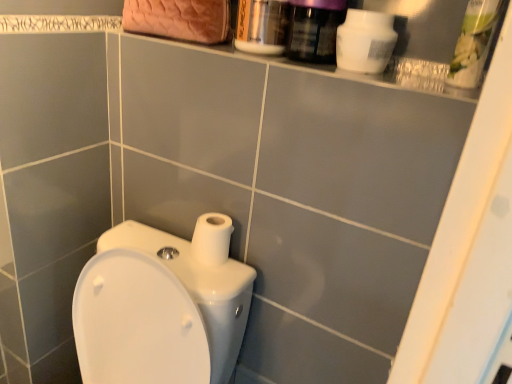
You are a GUI agent. You are given a task and a screenshot of the screen. Output one action in this format:
    pyautogui.click(x=<x>, y=<y>)
    Task: Click on the green plastic container at upper right, arranged as the 2th cleaning product when viewed from the left
    This screenshot has height=384, width=512.
    Given the screenshot: What is the action you would take?
    pyautogui.click(x=474, y=43)

What is the approximate width of purple glossy mouthwash at upper right, placed as the second mouthwash when sorted from left to right?

The width of purple glossy mouthwash at upper right, placed as the second mouthwash when sorted from left to right, is 3.79 inches.

The width and height of the screenshot is (512, 384). Describe the element at coordinates (365, 41) in the screenshot. I see `white matte bottle at upper right, marked as the 1th cleaning product in a left-to-right arrangement` at that location.

This screenshot has height=384, width=512. In order to click on white matte toilet paper at center in this screenshot , I will do `click(212, 239)`.

The image size is (512, 384). I want to click on white glossy toilet at lower left, so click(x=161, y=306).

Identify the location of mouthwash on the left of purple glossy mouthwash at upper right, placed as the second mouthwash when sorted from left to right. The image size is (512, 384). (262, 26).

How different are the orientations of purple glossy mouthwash at upper right, marked as the first mouthwash in a right-to-left arrangement, and metallic silver mouthwash at upper center, marked as the 2th mouthwash in a right-to-left arrangement, in degrees?

The facing directions of purple glossy mouthwash at upper right, marked as the first mouthwash in a right-to-left arrangement, and metallic silver mouthwash at upper center, marked as the 2th mouthwash in a right-to-left arrangement, are 2.15 degrees apart.

From a real-world perspective, who is located lower, purple glossy mouthwash at upper right, placed as the second mouthwash when sorted from left to right, or metallic silver mouthwash at upper center, marked as the 2th mouthwash in a right-to-left arrangement?

In real-world perspective, metallic silver mouthwash at upper center, marked as the 2th mouthwash in a right-to-left arrangement, is lower.

Is metallic silver mouthwash at upper center, marked as the 2th mouthwash in a right-to-left arrangement, to the left or to the right of green plastic container at upper right, marked as the first cleaning product in a right-to-left arrangement, in the image?

In the image, metallic silver mouthwash at upper center, marked as the 2th mouthwash in a right-to-left arrangement, appears on the left side of green plastic container at upper right, marked as the first cleaning product in a right-to-left arrangement.

Image resolution: width=512 pixels, height=384 pixels. I want to click on mouthwash that is the 2nd one when counting backward from the green plastic container at upper right, arranged as the 2th cleaning product when viewed from the left, so click(x=262, y=26).

Looking at this image, considering the sizes of objects metallic silver mouthwash at upper center, positioned as the first mouthwash in left-to-right order, and green plastic container at upper right, marked as the first cleaning product in a right-to-left arrangement, in the image provided, who is taller, metallic silver mouthwash at upper center, positioned as the first mouthwash in left-to-right order, or green plastic container at upper right, marked as the first cleaning product in a right-to-left arrangement,?

With more height is green plastic container at upper right, marked as the first cleaning product in a right-to-left arrangement.

Is metallic silver mouthwash at upper center, positioned as the first mouthwash in left-to-right order, looking in the opposite direction of green plastic container at upper right, arranged as the 2th cleaning product when viewed from the left?

metallic silver mouthwash at upper center, positioned as the first mouthwash in left-to-right order, is not turned away from green plastic container at upper right, arranged as the 2th cleaning product when viewed from the left.

Is green plastic container at upper right, arranged as the 2th cleaning product when viewed from the left, next to purple glossy mouthwash at upper right, placed as the second mouthwash when sorted from left to right?

They are not placed beside each other.

Considering the sizes of objects green plastic container at upper right, arranged as the 2th cleaning product when viewed from the left, and purple glossy mouthwash at upper right, placed as the second mouthwash when sorted from left to right, in the image provided, who is thinner, green plastic container at upper right, arranged as the 2th cleaning product when viewed from the left, or purple glossy mouthwash at upper right, placed as the second mouthwash when sorted from left to right,?

green plastic container at upper right, arranged as the 2th cleaning product when viewed from the left.

From a real-world perspective, relative to purple glossy mouthwash at upper right, placed as the second mouthwash when sorted from left to right, is green plastic container at upper right, arranged as the 2th cleaning product when viewed from the left, vertically above or below?

In terms of real-world spatial position, green plastic container at upper right, arranged as the 2th cleaning product when viewed from the left, is above purple glossy mouthwash at upper right, placed as the second mouthwash when sorted from left to right.

Between point (481, 10) and point (323, 14), which one is positioned behind?

The point (323, 14) is farther from the camera.

The height and width of the screenshot is (384, 512). I want to click on mouthwash that is the 2nd object to the left of the white matte bottle at upper right, which is the second cleaning product in right-to-left order, starting at the anchor, so click(x=262, y=26).

Based on their positions, is white matte bottle at upper right, marked as the 1th cleaning product in a left-to-right arrangement, located to the left or right of metallic silver mouthwash at upper center, positioned as the first mouthwash in left-to-right order?

white matte bottle at upper right, marked as the 1th cleaning product in a left-to-right arrangement, is to the right of metallic silver mouthwash at upper center, positioned as the first mouthwash in left-to-right order.

Is white matte bottle at upper right, which is the second cleaning product in right-to-left order, positioned before metallic silver mouthwash at upper center, marked as the 2th mouthwash in a right-to-left arrangement?

That is True.

Based on their sizes in the image, would you say white matte toilet paper at center is bigger or smaller than green plastic container at upper right, arranged as the 2th cleaning product when viewed from the left?

Considering their sizes, white matte toilet paper at center takes up less space than green plastic container at upper right, arranged as the 2th cleaning product when viewed from the left.

From a real-world perspective, which object stands above the other?

From a 3D spatial view, green plastic container at upper right, marked as the first cleaning product in a right-to-left arrangement, is above.

Is point (198, 233) positioned in front of point (474, 86)?

No, it is behind (474, 86).

Can you confirm if white matte toilet paper at center is shorter than green plastic container at upper right, marked as the first cleaning product in a right-to-left arrangement?

Correct, white matte toilet paper at center is not as tall as green plastic container at upper right, marked as the first cleaning product in a right-to-left arrangement.

Is white matte bottle at upper right, marked as the 1th cleaning product in a left-to-right arrangement, directly adjacent to purple glossy mouthwash at upper right, marked as the first mouthwash in a right-to-left arrangement?

Yes, white matte bottle at upper right, marked as the 1th cleaning product in a left-to-right arrangement, is next to purple glossy mouthwash at upper right, marked as the first mouthwash in a right-to-left arrangement.

Is white matte bottle at upper right, marked as the 1th cleaning product in a left-to-right arrangement, not inside purple glossy mouthwash at upper right, marked as the first mouthwash in a right-to-left arrangement?

Yes, white matte bottle at upper right, marked as the 1th cleaning product in a left-to-right arrangement, is outside of purple glossy mouthwash at upper right, marked as the first mouthwash in a right-to-left arrangement.

At what (x,y) coordinates should I click in order to perform the action: click on the 1st mouthwash behind the white matte bottle at upper right, which is the second cleaning product in right-to-left order, starting your count from the anchor. Please return your answer as a coordinate pair (x, y). Looking at the image, I should click on (314, 30).

From the picture: From a real-world perspective, which object stands above the other?

Result: purple glossy mouthwash at upper right, placed as the second mouthwash when sorted from left to right, from a real-world perspective.

Does point (255, 6) come behind point (337, 6)?

Yes, it is behind point (337, 6).

Identify the location of mouthwash that is on the left side of purple glossy mouthwash at upper right, marked as the first mouthwash in a right-to-left arrangement. (262, 26).

Does metallic silver mouthwash at upper center, marked as the 2th mouthwash in a right-to-left arrangement, turn towards purple glossy mouthwash at upper right, marked as the first mouthwash in a right-to-left arrangement?

No, metallic silver mouthwash at upper center, marked as the 2th mouthwash in a right-to-left arrangement, is not turned towards purple glossy mouthwash at upper right, marked as the first mouthwash in a right-to-left arrangement.

Is metallic silver mouthwash at upper center, positioned as the first mouthwash in left-to-right order, completely or partially outside of purple glossy mouthwash at upper right, placed as the second mouthwash when sorted from left to right?

metallic silver mouthwash at upper center, positioned as the first mouthwash in left-to-right order, lies outside purple glossy mouthwash at upper right, placed as the second mouthwash when sorted from left to right,'s area.

At what (x,y) coordinates should I click in order to perform the action: click on mouthwash that is in front of the metallic silver mouthwash at upper center, marked as the 2th mouthwash in a right-to-left arrangement. Please return your answer as a coordinate pair (x, y). Looking at the image, I should click on (314, 30).

Locate an element on the screen. The image size is (512, 384). the 2nd cleaning product counting from the right side of the metallic silver mouthwash at upper center, positioned as the first mouthwash in left-to-right order is located at coordinates (474, 43).

From the image, which object appears to be nearer to white matte toilet paper at center, metallic silver mouthwash at upper center, positioned as the first mouthwash in left-to-right order, or white matte bottle at upper right, which is the second cleaning product in right-to-left order?

Based on the image, metallic silver mouthwash at upper center, positioned as the first mouthwash in left-to-right order, appears to be nearer to white matte toilet paper at center.

Considering their positions, is purple glossy mouthwash at upper right, marked as the first mouthwash in a right-to-left arrangement, positioned further to white matte toilet paper at center than green plastic container at upper right, arranged as the 2th cleaning product when viewed from the left?

green plastic container at upper right, arranged as the 2th cleaning product when viewed from the left, is positioned further to the anchor white matte toilet paper at center.

Estimate the real-world distances between objects in this image. Which object is closer to white matte bottle at upper right, which is the second cleaning product in right-to-left order, green plastic container at upper right, marked as the first cleaning product in a right-to-left arrangement, or metallic silver mouthwash at upper center, positioned as the first mouthwash in left-to-right order?

Based on the image, green plastic container at upper right, marked as the first cleaning product in a right-to-left arrangement, appears to be nearer to white matte bottle at upper right, which is the second cleaning product in right-to-left order.

Based on their spatial positions, is metallic silver mouthwash at upper center, marked as the 2th mouthwash in a right-to-left arrangement, or white matte toilet paper at center further from white glossy toilet at lower left?

The object further to white glossy toilet at lower left is metallic silver mouthwash at upper center, marked as the 2th mouthwash in a right-to-left arrangement.

From the image, which object appears to be nearer to green plastic container at upper right, arranged as the 2th cleaning product when viewed from the left, white matte toilet paper at center or white glossy toilet at lower left?

The object closer to green plastic container at upper right, arranged as the 2th cleaning product when viewed from the left, is white matte toilet paper at center.

Looking at the image, which one is located further to white matte toilet paper at center, purple glossy mouthwash at upper right, placed as the second mouthwash when sorted from left to right, or white glossy toilet at lower left?

purple glossy mouthwash at upper right, placed as the second mouthwash when sorted from left to right.

From the picture: From the image, which object appears to be farther from purple glossy mouthwash at upper right, marked as the first mouthwash in a right-to-left arrangement, white matte toilet paper at center or metallic silver mouthwash at upper center, positioned as the first mouthwash in left-to-right order?

white matte toilet paper at center is positioned further to the anchor purple glossy mouthwash at upper right, marked as the first mouthwash in a right-to-left arrangement.

When comparing their distances from metallic silver mouthwash at upper center, marked as the 2th mouthwash in a right-to-left arrangement, does white matte toilet paper at center or purple glossy mouthwash at upper right, placed as the second mouthwash when sorted from left to right, seem further?

Based on the image, white matte toilet paper at center appears to be further to metallic silver mouthwash at upper center, marked as the 2th mouthwash in a right-to-left arrangement.

The height and width of the screenshot is (384, 512). Find the location of `mouthwash situated between metallic silver mouthwash at upper center, marked as the 2th mouthwash in a right-to-left arrangement, and green plastic container at upper right, arranged as the 2th cleaning product when viewed from the left, from left to right`. mouthwash situated between metallic silver mouthwash at upper center, marked as the 2th mouthwash in a right-to-left arrangement, and green plastic container at upper right, arranged as the 2th cleaning product when viewed from the left, from left to right is located at coordinates (314, 30).

This screenshot has height=384, width=512. I want to click on toilet paper between green plastic container at upper right, arranged as the 2th cleaning product when viewed from the left, and white glossy toilet at lower left in the up-down direction, so click(212, 239).

The image size is (512, 384). In order to click on toilet paper between metallic silver mouthwash at upper center, marked as the 2th mouthwash in a right-to-left arrangement, and white glossy toilet at lower left in the up-down direction in this screenshot , I will do `click(212, 239)`.

Where is `cleaning product between green plastic container at upper right, arranged as the 2th cleaning product when viewed from the left, and white glossy toilet at lower left from top to bottom`? The height and width of the screenshot is (384, 512). cleaning product between green plastic container at upper right, arranged as the 2th cleaning product when viewed from the left, and white glossy toilet at lower left from top to bottom is located at coordinates (365, 41).